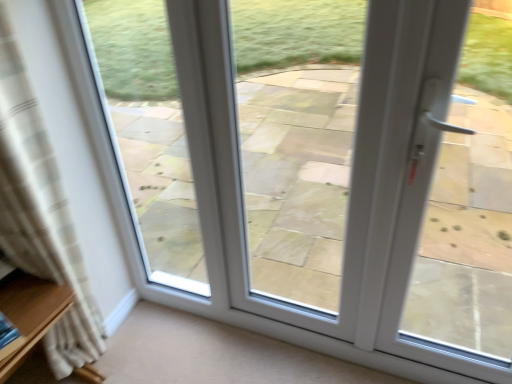
Question: From their relative heights in the image, would you say white glass door at center is taller or shorter than wooden shelf at left?

Choices:
 (A) short
 (B) tall

Answer: (B)

Question: Considering the positions of white glass door at center and wooden shelf at left in the image, is white glass door at center bigger or smaller than wooden shelf at left?

Choices:
 (A) small
 (B) big

Answer: (A)

Question: Based on their relative distances, which object is nearer to the white glass door at center?

Choices:
 (A) wooden shelf at left
 (B) white plastic door handle at right
 (C) white glass door at left
 (D) beige plaid curtain at left

Answer: (C)

Question: Which is farther from the white glass door at left?

Choices:
 (A) white glass door at center
 (B) beige plaid curtain at left
 (C) white plastic door handle at right
 (D) wooden shelf at left

Answer: (C)